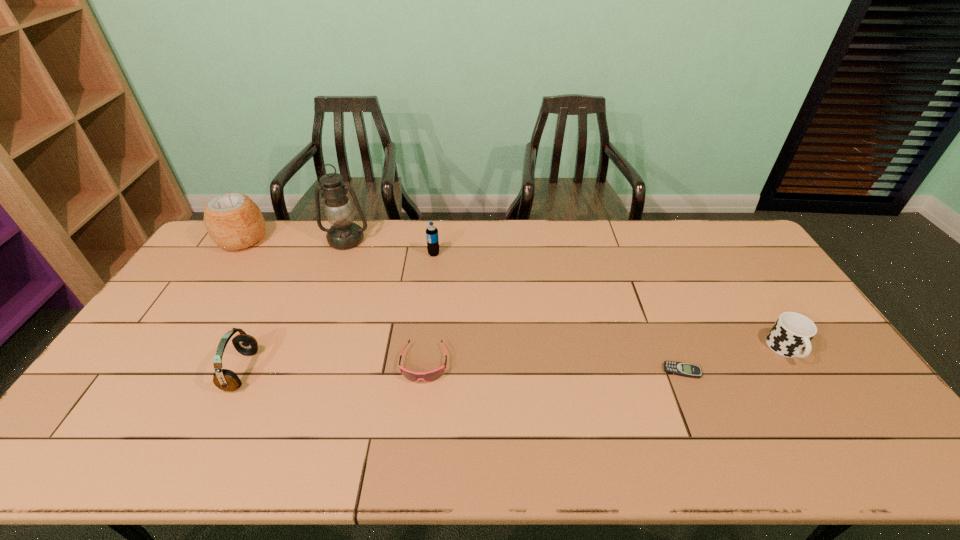
I want to click on free space that satisfies the following two spatial constraints: 1. on the side of the rightmost object with the handle; 2. on the ear cups of the second object from left to right, so click(800, 370).

Find the location of `free space that satisfies the following two spatial constraints: 1. on the ear cups of the headset; 2. on the right side of the beeper`. free space that satisfies the following two spatial constraints: 1. on the ear cups of the headset; 2. on the right side of the beeper is located at coordinates pyautogui.click(x=242, y=371).

Where is `vacant region that satisfies the following two spatial constraints: 1. on the side of the rightmost object with the handle; 2. on the ear cups of the second object from left to right`? vacant region that satisfies the following two spatial constraints: 1. on the side of the rightmost object with the handle; 2. on the ear cups of the second object from left to right is located at coordinates (800, 370).